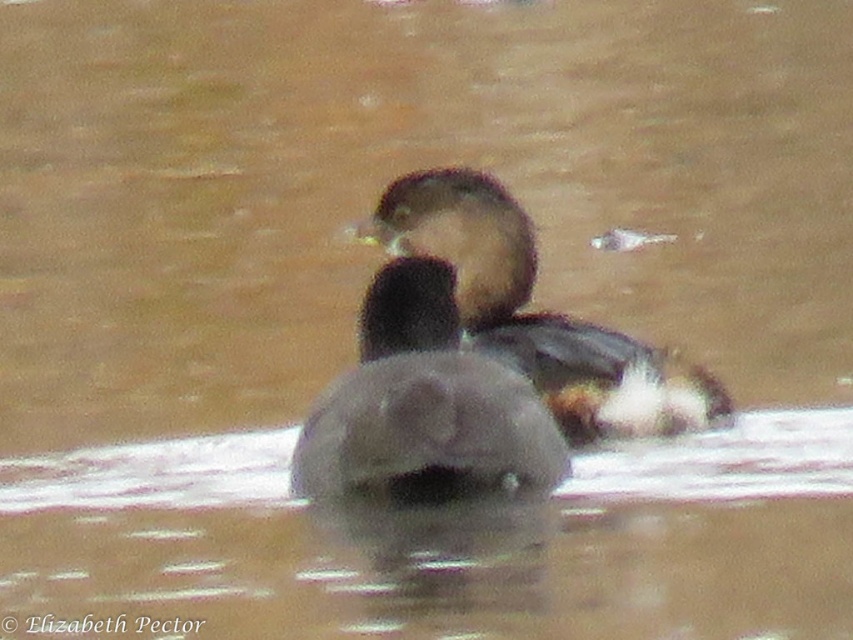
Question: Where is brown matte duck at center located in relation to brown speckled feathers at center in the image?

Choices:
 (A) left
 (B) right

Answer: (A)

Question: Which point is closer to the camera taking this photo?

Choices:
 (A) (398, 483)
 (B) (680, 406)

Answer: (A)

Question: Considering the relative positions of brown matte duck at center and brown speckled feathers at center in the image provided, where is brown matte duck at center located with respect to brown speckled feathers at center?

Choices:
 (A) right
 (B) left

Answer: (B)

Question: Is brown matte duck at center in front of brown speckled feathers at center?

Choices:
 (A) no
 (B) yes

Answer: (B)